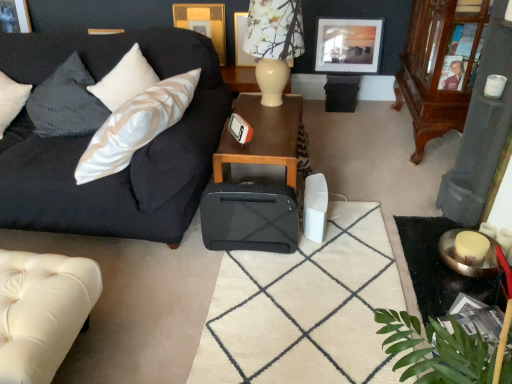
Question: From the image's perspective, is white leather studio couch at lower left, the 2th studio couch in the top-to-bottom sequence, positioned above or below wooden picture frame at upper left, acting as the 4th picture frame starting from the right?

Choices:
 (A) above
 (B) below

Answer: (B)

Question: Visually, is white leather studio couch at lower left, the 1th studio couch positioned from the bottom, positioned to the left or to the right of wooden picture frame at upper left, acting as the 4th picture frame starting from the right?

Choices:
 (A) right
 (B) left

Answer: (A)

Question: Which of these objects is positioned closest to the mahogany wood dresser at right?

Choices:
 (A) wooden picture frame at upper center, arranged as the second picture frame when viewed from the right
 (B) satin black couch at left, the 2th studio couch positioned from the bottom
 (C) white ceramic lamp at upper center
 (D) matte black picture frame at upper center, marked as the 1th picture frame in a right-to-left arrangement
 (E) wooden picture frame at upper center, the second picture frame when ordered from left to right

Answer: (D)

Question: Which is farther from the white leather studio couch at lower left, the 2th studio couch in the top-to-bottom sequence?

Choices:
 (A) black fabric suitcase at center
 (B) wooden table at center
 (C) wooden picture frame at upper center, the second picture frame when ordered from left to right
 (D) satin black couch at left, acting as the first studio couch starting from the top
 (E) green leafy plant at lower right

Answer: (C)